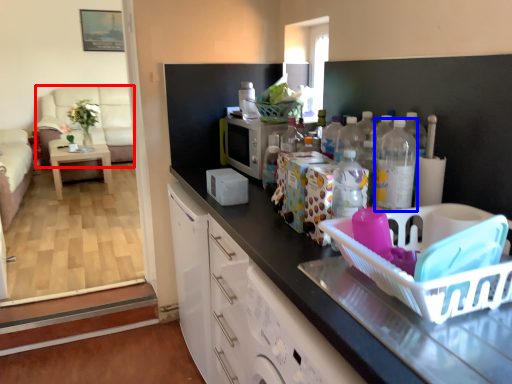
Question: Which point is further to the camera, couch (highlighted by a red box) or bottle (highlighted by a blue box)?

Choices:
 (A) couch
 (B) bottle

Answer: (A)